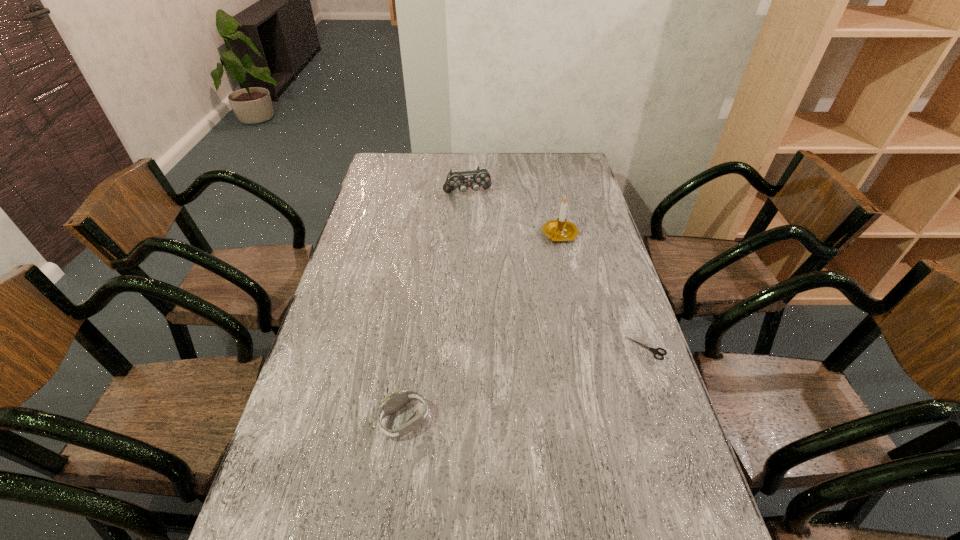
Find the location of `free space on the desktop that is between the third tallest object and the third farthest object and is positioned with a handle on the tallest object`. free space on the desktop that is between the third tallest object and the third farthest object and is positioned with a handle on the tallest object is located at coordinates (552, 376).

Image resolution: width=960 pixels, height=540 pixels. Identify the location of free space on the desktop that is between the second shortest object and the second nearest object and is positioned on the surface of the control with buttons. (529, 383).